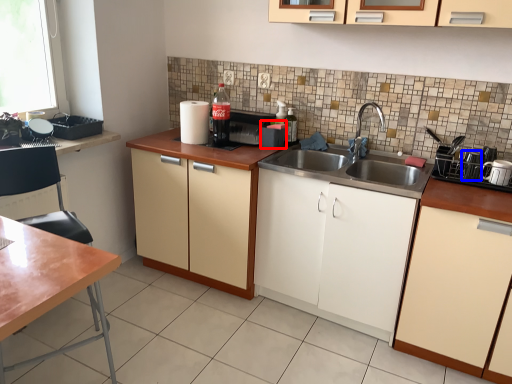
Question: Which object is further to the camera taking this photo, appliance (highlighted by a red box) or appliance (highlighted by a blue box)?

Choices:
 (A) appliance
 (B) appliance

Answer: (A)